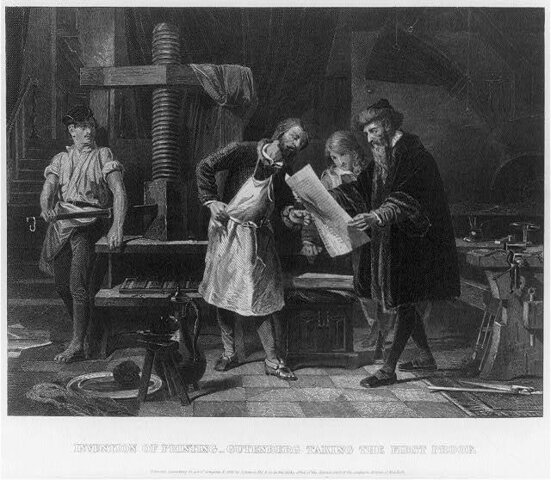
The image size is (551, 480). Identify the location of jug. click(185, 348).